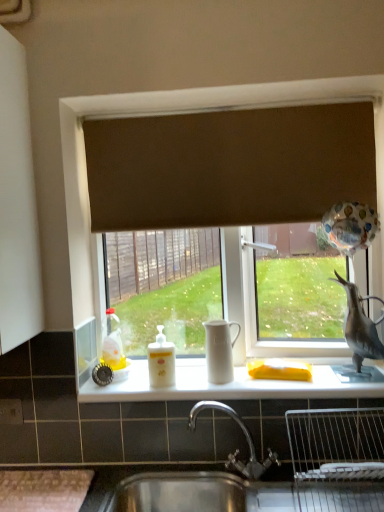
Find the location of a particular element. empty space that is ontop of white glossy counter top at center is located at coordinates (253, 383).